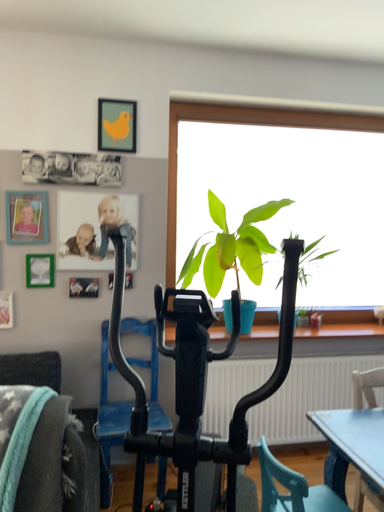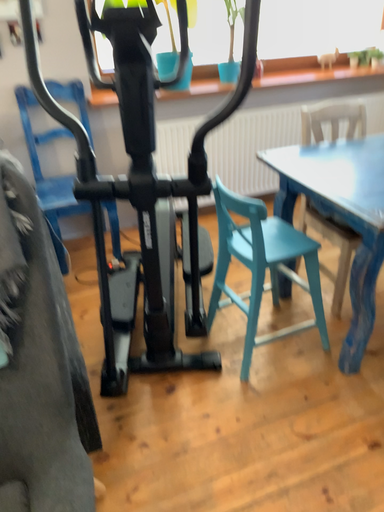
Question: Which way did the camera rotate in the video?

Choices:
 (A) rotated upward
 (B) rotated downward

Answer: (B)